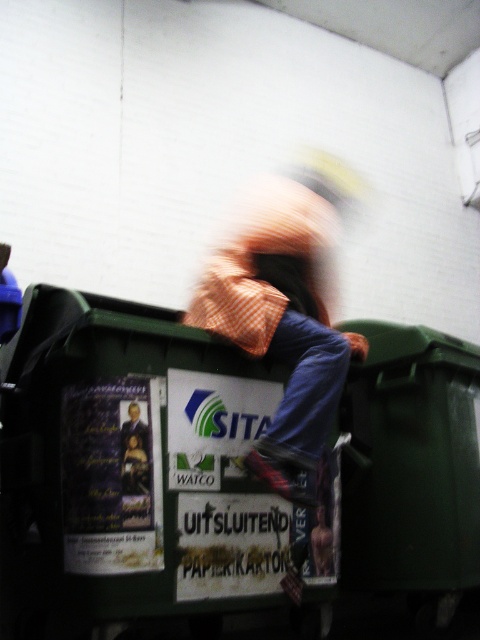
You are a waste management inspector checking the scene. You notice the green plastic bin at center and the orange checkered shirt at center. Which object is taller?

The green plastic bin at center is much taller than the orange checkered shirt at center.

You are standing next to the green plastic bin at center and want to hand a paper carton to a friend who is 5.34 feet away from you. Can you reach them without moving your position?

The distance between you and your friend is 5.34 feet, so you cannot reach them without moving since the average human arm length is about 2.5 feet.

You are standing in front of the green recycling bin labeled SITA and WATCO. There are two points marked on the bin at coordinates point (141, 467) and point (249, 337). Which point is closer to you?

Point (141, 467) is closer to the viewer than point (249, 337).